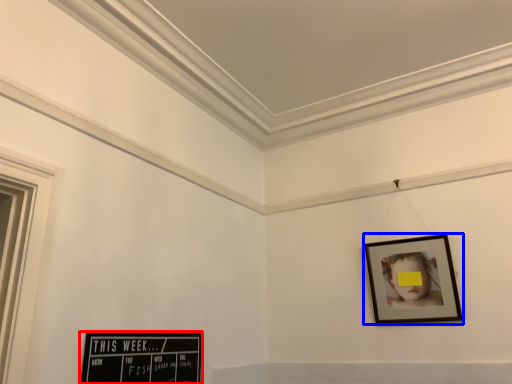
Question: Which object is further to the camera taking this photo, picture frame (highlighted by a red box) or picture frame (highlighted by a blue box)?

Choices:
 (A) picture frame
 (B) picture frame

Answer: (B)